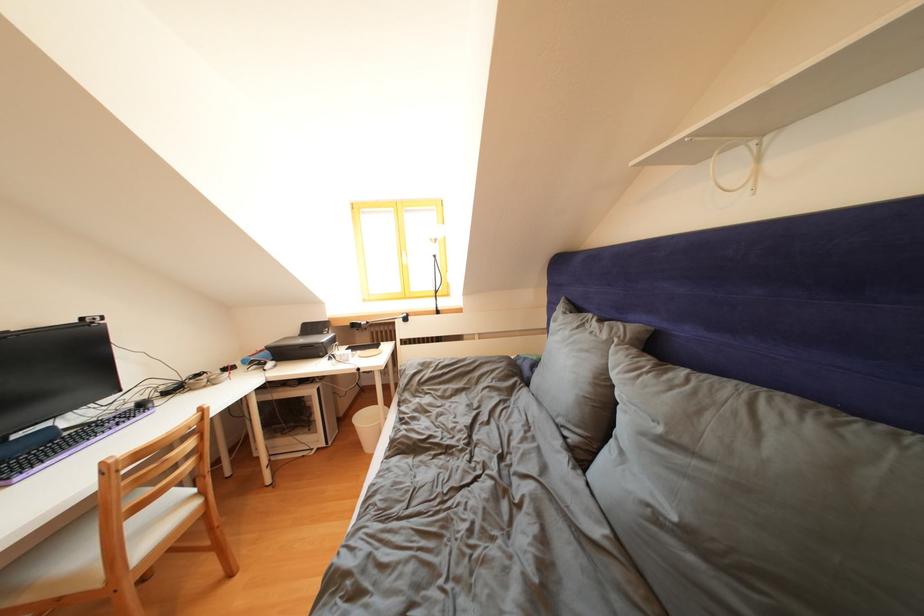
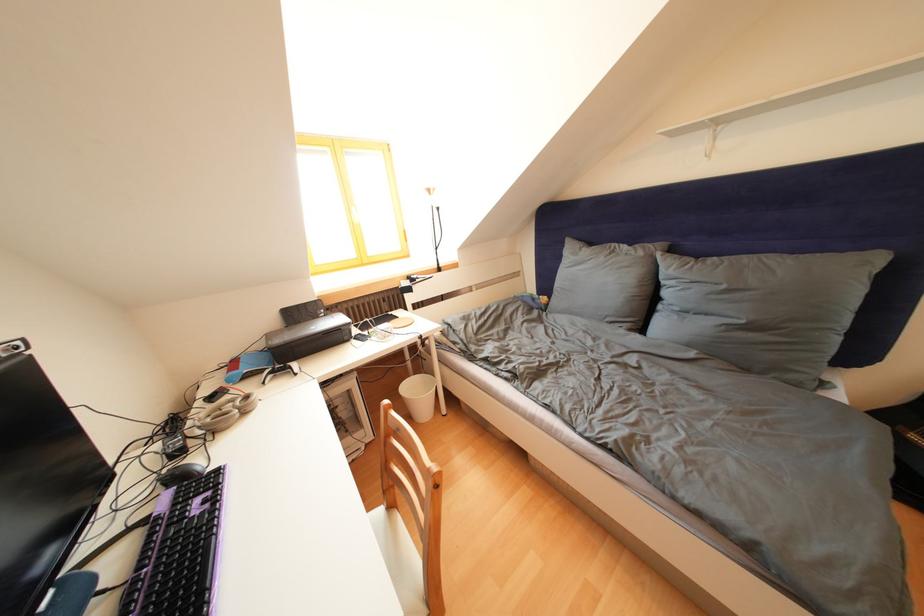
Locate, in the second image, the point that corresponds to [233,375] in the first image.

(220, 403)